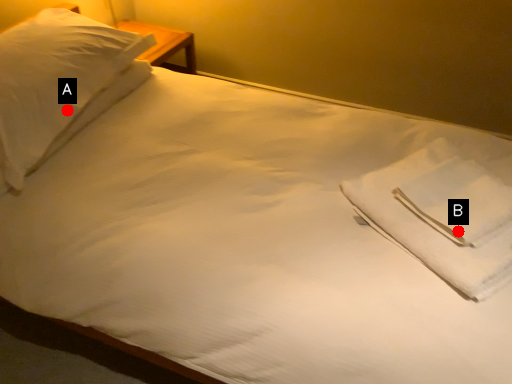
Question: Two points are circled on the image, labeled by A and B beside each circle. Which point is closer to the camera?

Choices:
 (A) A is closer
 (B) B is closer

Answer: (B)